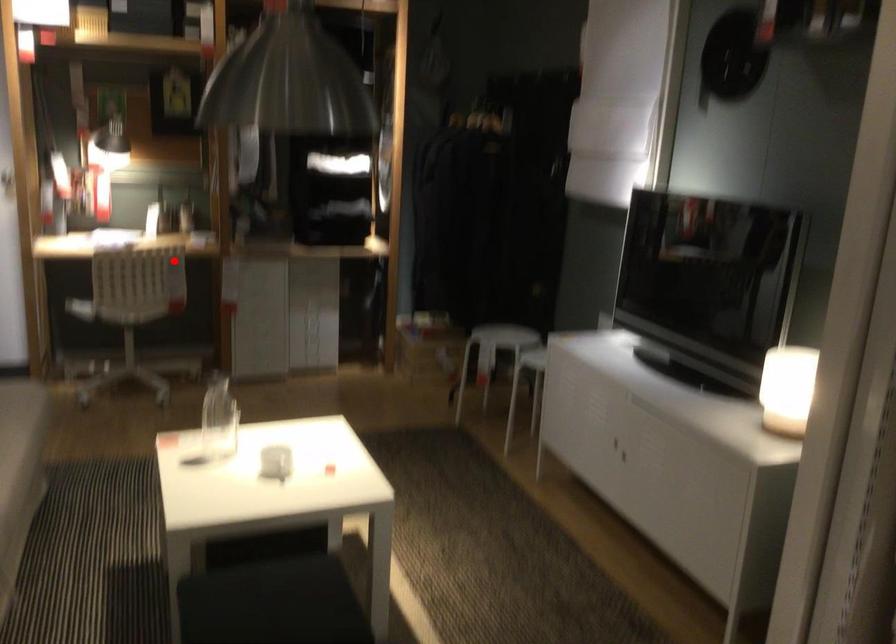
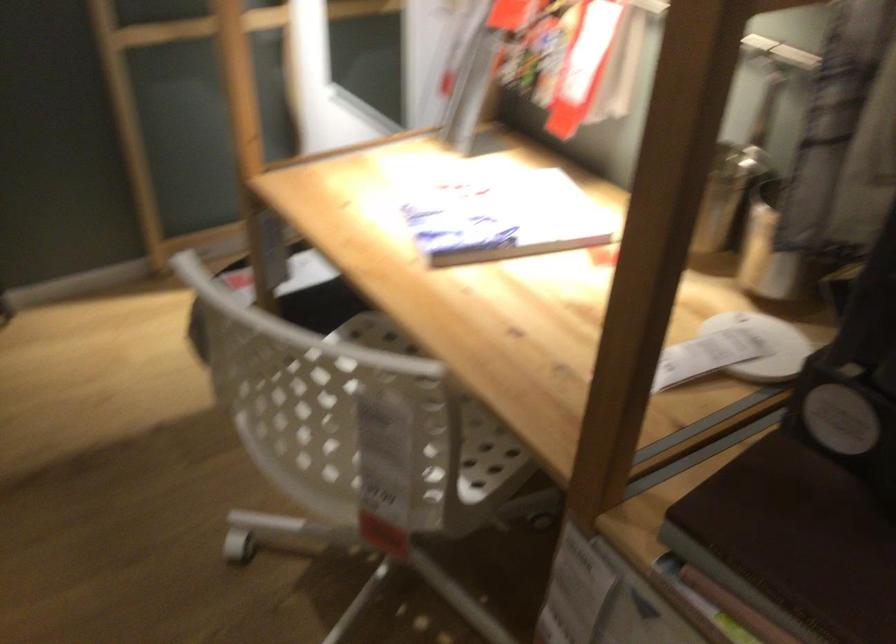
Question: I am providing you with two images of the same scene from different viewpoints. Image1 has a red point marked. In image2, the corresponding 3D location appears at what relative position? Reply with the corresponding letter.

Choices:
 (A) Closer
 (B) Farther

Answer: (A)